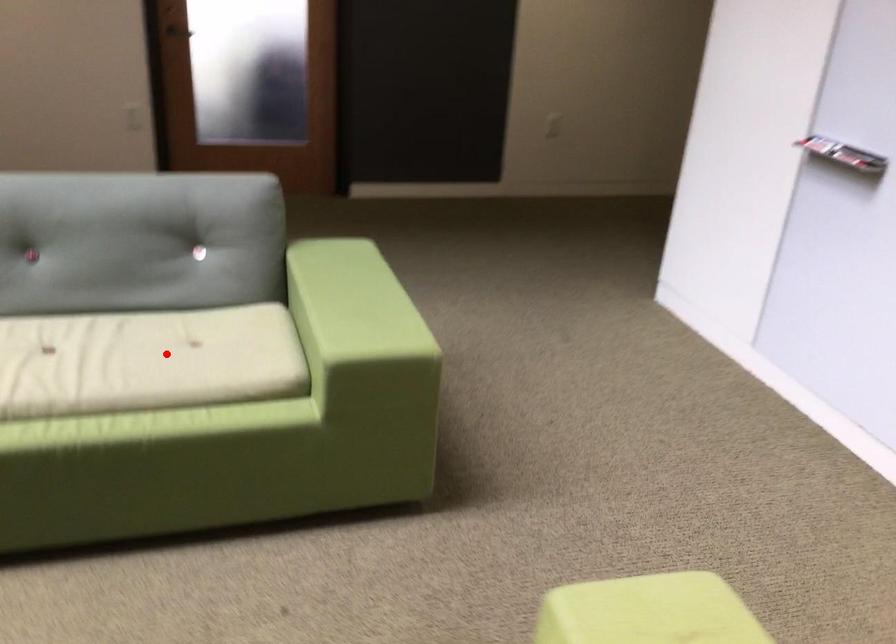
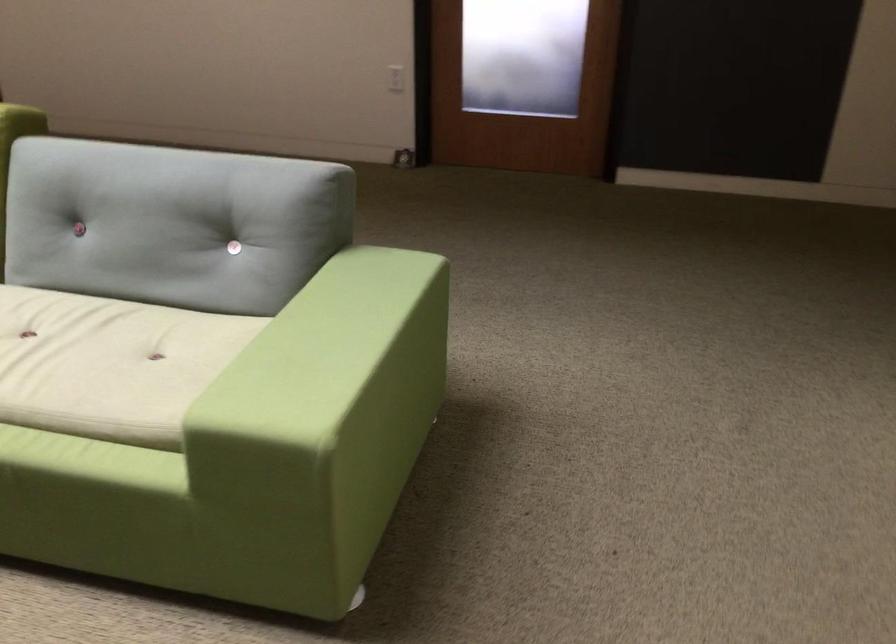
In the second image, find the point that corresponds to the highlighted location in the first image.

(109, 364)